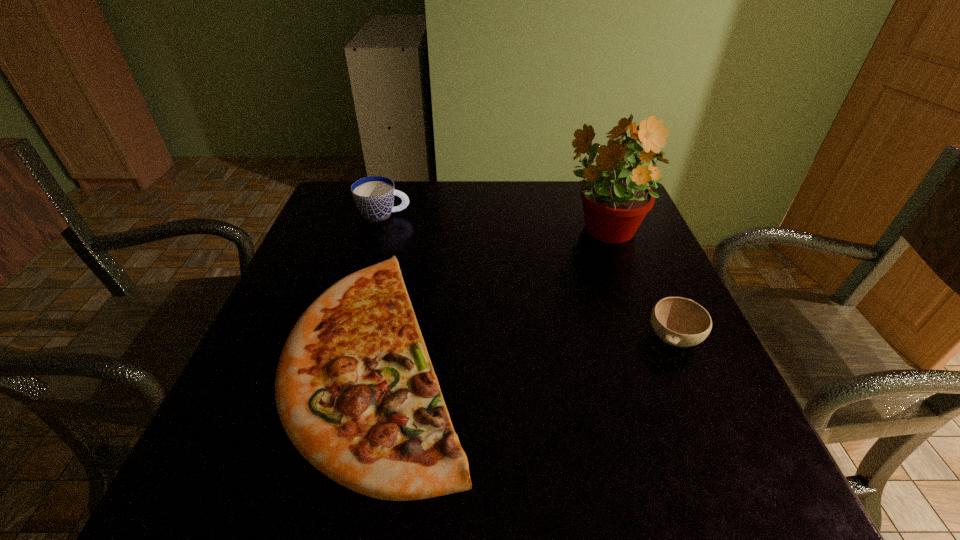
This screenshot has height=540, width=960. What are the coordinates of `cup positioned at the left edge` in the screenshot? It's located at (374, 196).

Locate an element on the screen. pizza located at the left edge is located at coordinates (355, 389).

In order to click on flowerpot at the right edge in this screenshot , I will do `click(616, 199)`.

Find the location of a particular element. bowl that is positioned at the right edge is located at coordinates (681, 322).

Find the location of a particular element. The height and width of the screenshot is (540, 960). object positioned at the far left corner is located at coordinates (374, 196).

Where is `object that is at the near left corner`? Image resolution: width=960 pixels, height=540 pixels. object that is at the near left corner is located at coordinates (355, 389).

This screenshot has width=960, height=540. I want to click on object located at the far right corner, so coord(616,199).

In order to click on vacant space at the far edge in this screenshot , I will do `click(471, 191)`.

Find the location of a particular element. vacant area at the near edge is located at coordinates (456, 500).

The height and width of the screenshot is (540, 960). In the image, there is a desktop. In order to click on blank space at the left edge in this screenshot , I will do `click(335, 252)`.